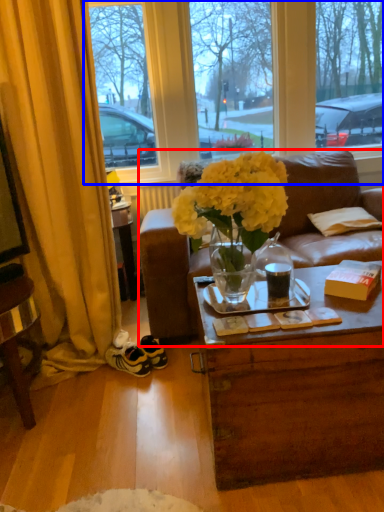
Question: Which object is further to the camera taking this photo, studio couch (highlighted by a red box) or window (highlighted by a blue box)?

Choices:
 (A) studio couch
 (B) window

Answer: (B)